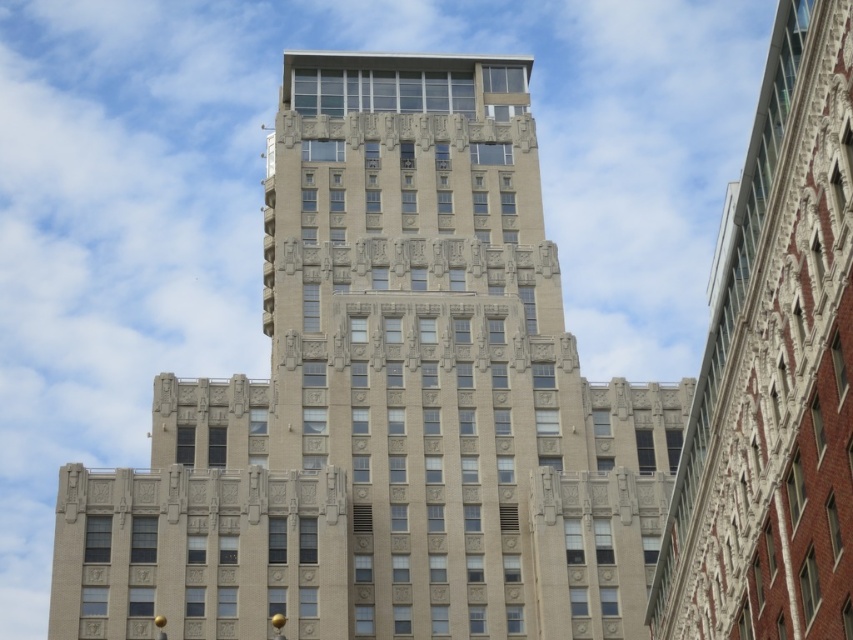
Does beige stone building at center appear over beige stone building at upper center?

Correct, beige stone building at center is located above beige stone building at upper center.

Does beige stone building at center appear on the right side of beige stone building at upper center?

In fact, beige stone building at center is to the left of beige stone building at upper center.

Between point (180, 536) and point (729, 192), which one is positioned in front?

Point (729, 192) is more forward.

Image resolution: width=853 pixels, height=640 pixels. I want to click on beige stone building at center, so click(x=387, y=403).